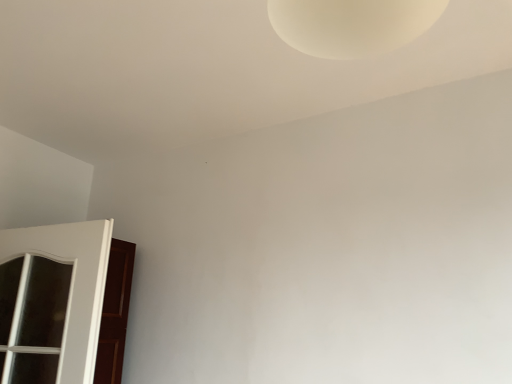
Where is `white glossy door at lower left`? Image resolution: width=512 pixels, height=384 pixels. white glossy door at lower left is located at coordinates (57, 295).

The height and width of the screenshot is (384, 512). What do you see at coordinates (57, 295) in the screenshot?
I see `white glossy door at lower left` at bounding box center [57, 295].

What are the coordinates of `white glossy door at lower left` in the screenshot? It's located at click(x=57, y=295).